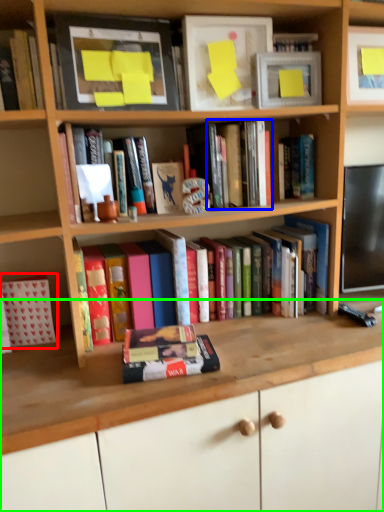
Question: Which is farther away from book (highlighted by a red box)? book (highlighted by a blue box) or computer desk (highlighted by a green box)?

Choices:
 (A) book
 (B) computer desk

Answer: (A)